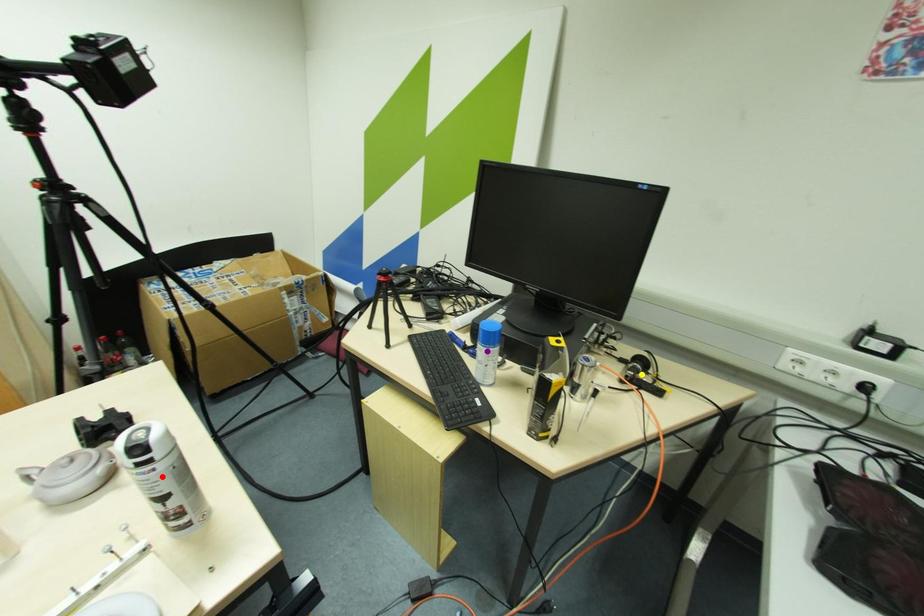
Order these from nearest to farthest:
A) red point
B) purple point
C) yellow point

yellow point, purple point, red point